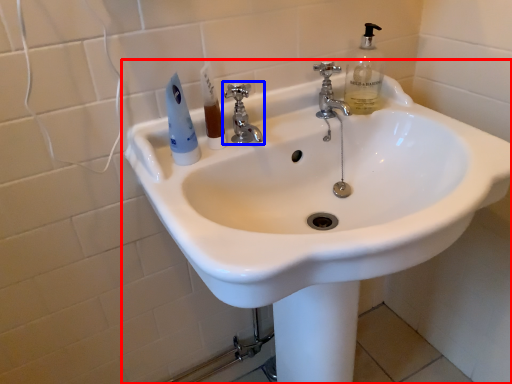
Question: Which of the following is the farthest to the observer, sink (highlighted by a red box) or tap (highlighted by a blue box)?

Choices:
 (A) sink
 (B) tap

Answer: (B)